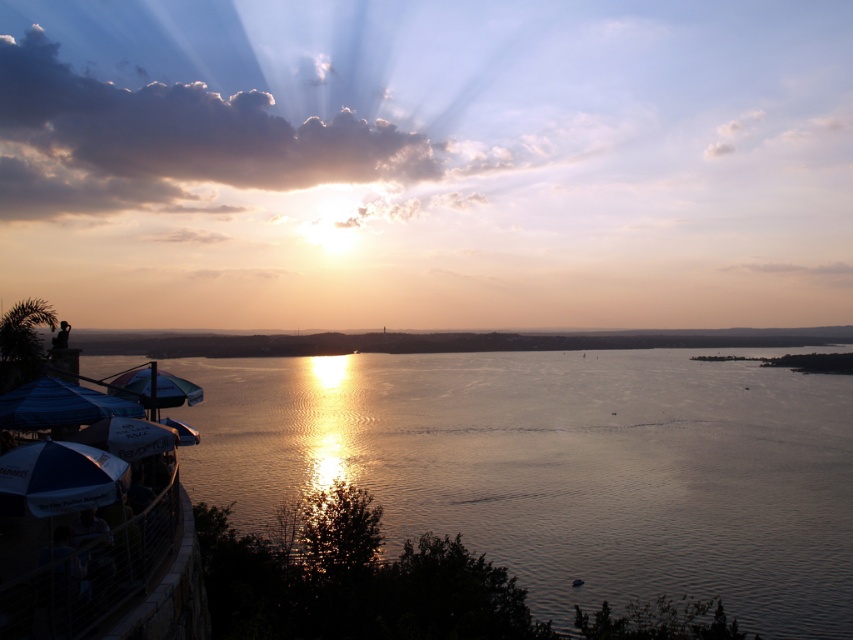
Who is lower down, glistening water at center or blue fabric umbrella at lower left?

glistening water at center is lower down.

Measure the distance from glistening water at center to blue fabric umbrella at lower left.

glistening water at center is 244.48 feet from blue fabric umbrella at lower left.

At what (x,y) coordinates should I click in order to perform the action: click on glistening water at center. Please return your answer as a coordinate pair (x, y). Looking at the image, I should click on (560, 467).

Where is `glistening water at center`? This screenshot has width=853, height=640. glistening water at center is located at coordinates (560, 467).

Does white fabric umbrella at lower left have a greater width compared to blue fabric umbrella at lower left?

No, white fabric umbrella at lower left is not wider than blue fabric umbrella at lower left.

Based on the photo, between white fabric umbrella at lower left and blue fabric umbrella at lower left, which one appears on the left side from the viewer's perspective?

blue fabric umbrella at lower left is more to the left.

Is point (39, 486) behind point (96, 413)?

That is False.

This screenshot has width=853, height=640. I want to click on white fabric umbrella at lower left, so click(x=57, y=477).

Does glistening water at center have a lesser height compared to white fabric umbrella at lower left?

No.

What do you see at coordinates (560, 467) in the screenshot? This screenshot has width=853, height=640. I see `glistening water at center` at bounding box center [560, 467].

The image size is (853, 640). I want to click on glistening water at center, so click(560, 467).

The image size is (853, 640). In order to click on glistening water at center in this screenshot , I will do `click(560, 467)`.